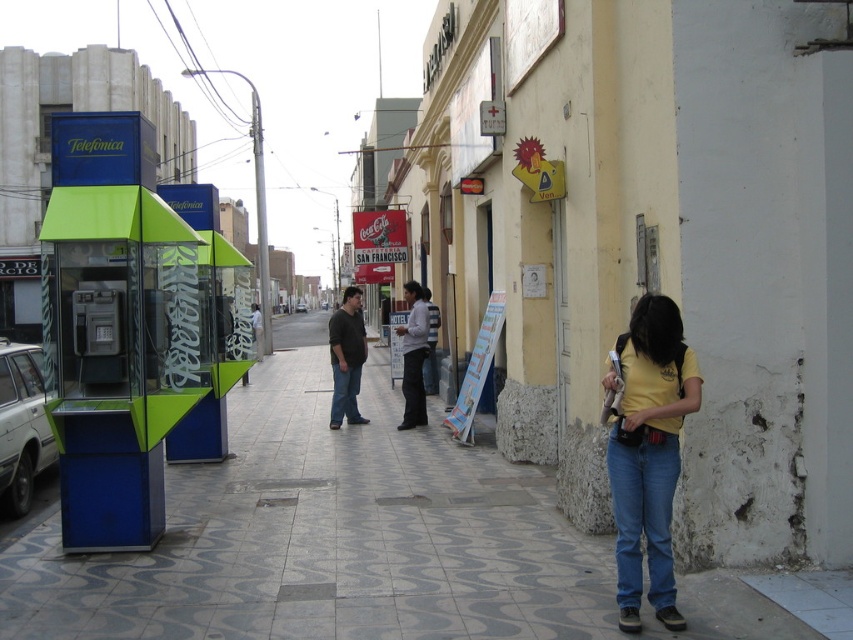
Does dark gray sweater at center have a greater width compared to white shirt at center?

Yes, dark gray sweater at center is wider than white shirt at center.

Does point (341, 385) come behind point (413, 369)?

Yes, point (341, 385) is farther from viewer.

Is point (343, 342) closer to viewer compared to point (405, 346)?

Yes, it is in front of point (405, 346).

You are a GUI agent. You are given a task and a screenshot of the screen. Output one action in this format:
    pyautogui.click(x=<x>, y=<y>)
    Task: Click on the dark gray sweater at center
    The width and height of the screenshot is (853, 640).
    Given the screenshot: What is the action you would take?
    346,358

Looking at this image, which is below, blue denim jeans at lower right or dark gray sweater at center?

blue denim jeans at lower right is lower down.

Describe the element at coordinates (643, 515) in the screenshot. I see `blue denim jeans at lower right` at that location.

At what (x,y) coordinates should I click in order to perform the action: click on blue denim jeans at lower right. Please return your answer as a coordinate pair (x, y). Looking at the image, I should click on (643, 515).

Is white shirt at center wider than blue denim jeans at center?

Yes, white shirt at center is wider than blue denim jeans at center.

Where is `white shirt at center`? white shirt at center is located at coordinates (413, 356).

What are the coordinates of `white shirt at center` in the screenshot? It's located at point(413,356).